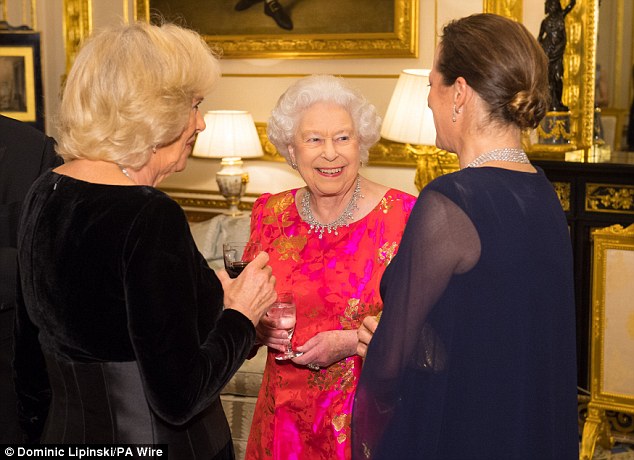
What are the coordinates of `lampshade` in the screenshot? It's located at (224, 138), (411, 119).